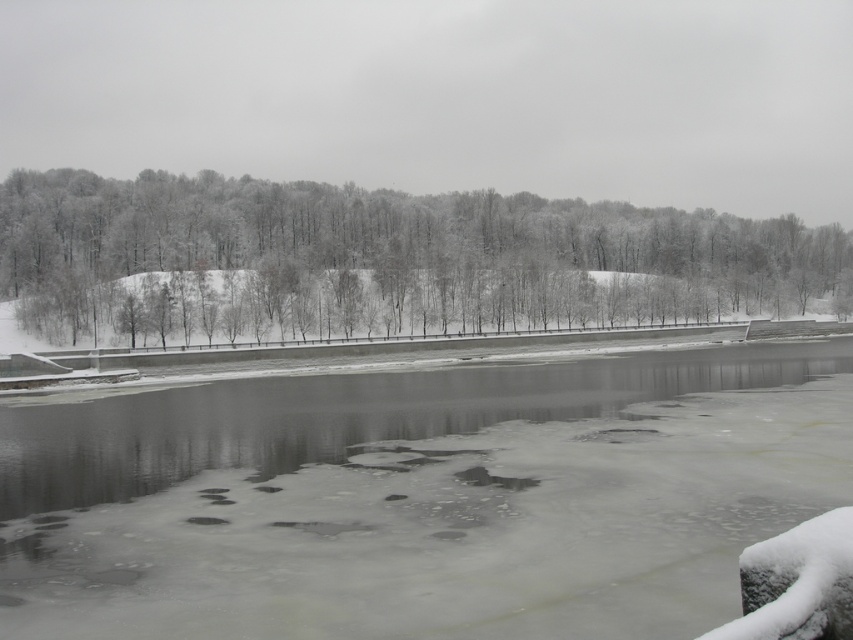
You are an ice skater planning to glide from the frozen ice at center to the white frosty trees at upper left. Based on their positions, which direction should you head towards?

The frozen ice at center is positioned on the left side of white frosty trees at upper left, so you should head towards the right to reach the white frosty trees at upper left.

You are standing on the concrete embankment and want to cross to the other side of the frozen ice at center. Based on the ice conditions described, would you consider the ice at the center safe to walk on?

The frozen ice at center is located at point (421, 499), but the description mentions that the ice has patches of open water and small dark spots indicating thin ice or submerged objects. Therefore, the ice at the center may not be safe to walk on due to potential thin areas or hazards.